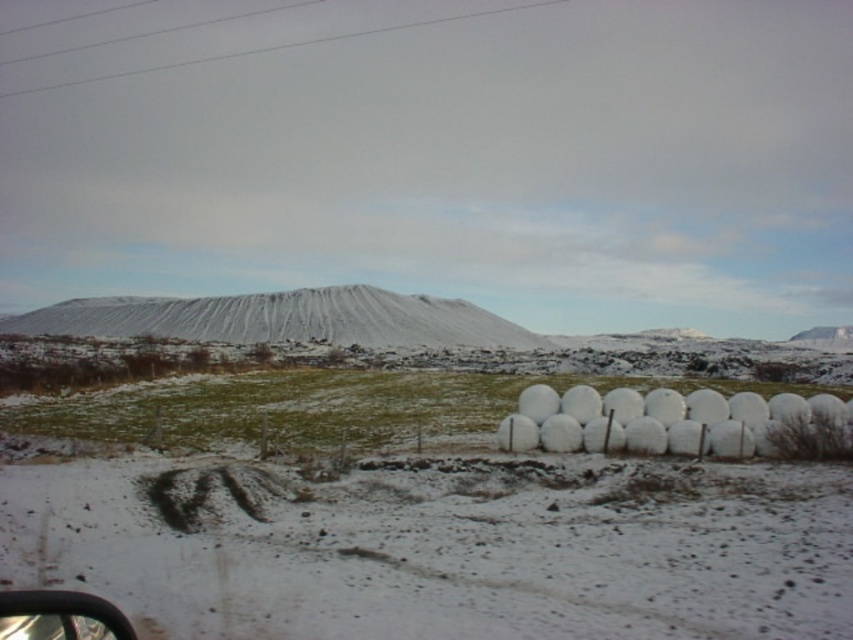
Question: Does white snow-covered mountain at center come in front of transparent glass car window at lower left?

Choices:
 (A) yes
 (B) no

Answer: (B)

Question: Which of the following is the farthest from the observer?

Choices:
 (A) transparent glass car window at lower left
 (B) white snow-covered mountain at center

Answer: (B)

Question: Considering the relative positions of white snow-covered mountain at center and transparent glass car window at lower left in the image provided, where is white snow-covered mountain at center located with respect to transparent glass car window at lower left?

Choices:
 (A) left
 (B) right

Answer: (A)

Question: From the image, what is the correct spatial relationship of white snow-covered mountain at center in relation to transparent glass car window at lower left?

Choices:
 (A) above
 (B) below

Answer: (A)